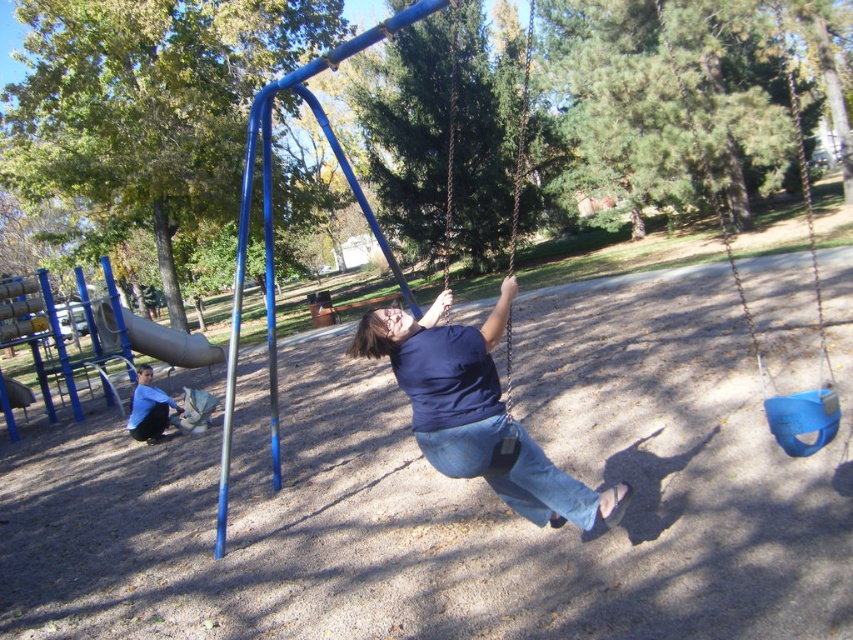
You are a parent trying to locate your child who is wearing a dark blue shirt and jeans at the playground. You see the dark blue fabric at center and denim at center. Which one is closer to you?

The dark blue fabric at center is closer to you because the denim at center is behind it.

You are a parent watching your child play at the playground. You notice the dark blue fabric at center and denim at center. Which item is taller?

The dark blue fabric at center is much taller than the denim at center.

You are at the playground and want to go down the slide. You see the blue plastic swing at upper right and the brushed metal slide at left. Which direction should you move to reach the slide?

The blue plastic swing at upper right is positioned on the right side of the brushed metal slide at left, so you should move to the left to reach the slide.